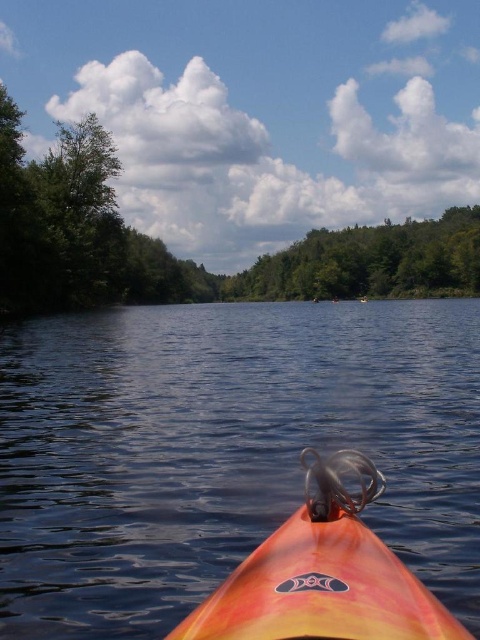
You are standing on the shore and see the point marked at coordinates (224, 451) in the image. What object is located at that point?

The point at coordinates (224, 451) indicates the orange plastic kayak at lower center.

You are navigating a kayak and see two points on the water ahead of you. The first point is at coordinates point (447,410) and the second is at point (324,516). Which point is closer to your current position?

Point (324,516) is closer to your current position because it is in front of point (447,410), which is further away.

Consider the image. You are in a kayak and see a point marked at coordinates (188, 259). What object is this point located on?

The point at coordinates (188, 259) is located on the green leafy tree at upper center.